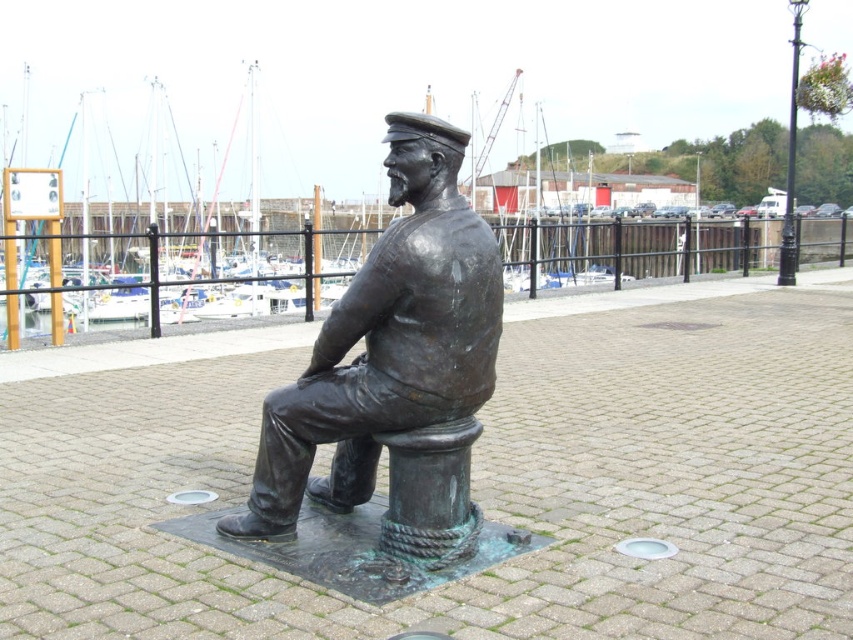
Question: From the image, what is the correct spatial relationship of bronze statue at center in relation to black wrought iron pole at upper right?

Choices:
 (A) above
 (B) below

Answer: (B)

Question: Which of the following is the farthest from the observer?

Choices:
 (A) (483, 360)
 (B) (791, 154)

Answer: (B)

Question: Does bronze statue at center have a larger size compared to black wrought iron pole at upper right?

Choices:
 (A) no
 (B) yes

Answer: (A)

Question: Is bronze statue at center closer to the viewer compared to black wrought iron pole at upper right?

Choices:
 (A) no
 (B) yes

Answer: (B)